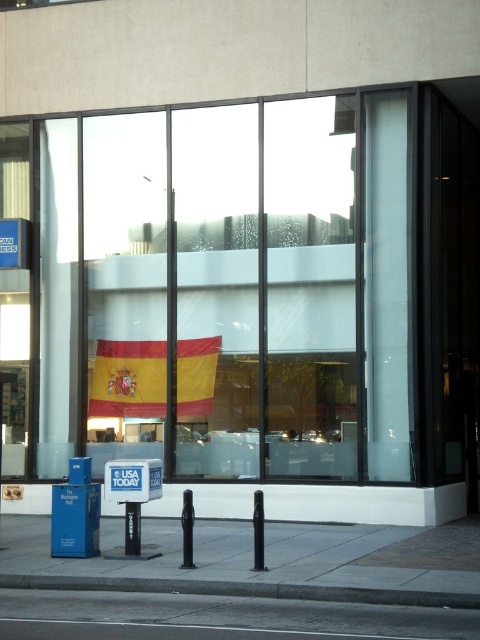
Question: Does yellow fabric flag at center lie behind gray concrete pavement at lower center?

Choices:
 (A) yes
 (B) no

Answer: (A)

Question: Is gray concrete pavement at lower center to the right of gray asphalt at lower center from the viewer's perspective?

Choices:
 (A) yes
 (B) no

Answer: (A)

Question: Which of the following is the farthest from the observer?

Choices:
 (A) (145, 416)
 (B) (247, 540)
 (C) (430, 632)

Answer: (A)

Question: In this image, where is yellow fabric flag at center located relative to red/yellow striped flag at center?

Choices:
 (A) below
 (B) above

Answer: (B)

Question: Which object appears closest to the camera in this image?

Choices:
 (A) gray concrete pavement at lower center
 (B) red/yellow striped flag at center
 (C) yellow fabric flag at center
 (D) gray asphalt at lower center

Answer: (D)

Question: Estimate the real-world distances between objects in this image. Which object is farther from the red/yellow striped flag at center?

Choices:
 (A) yellow fabric flag at center
 (B) gray concrete pavement at lower center
 (C) gray asphalt at lower center

Answer: (C)